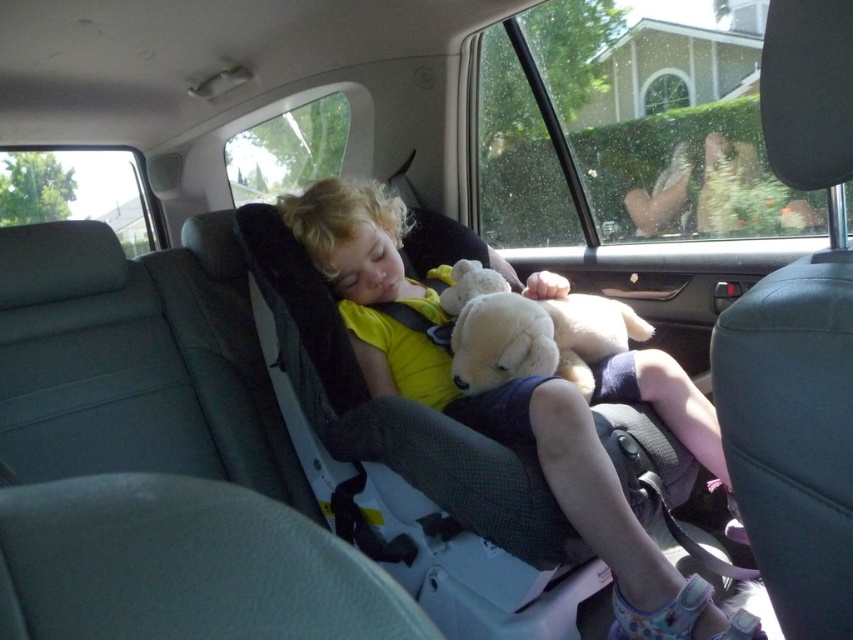
You are a safety inspector checking the car seat installation. You notice the yellow fabric child at center and the white plush teddy bear at center. Which object is positioned closer to the front of the car?

The yellow fabric child at center is closer to the viewer than the white plush teddy bear at center, so the yellow fabric child at center is positioned closer to the front of the car.

You are a safety inspector checking the car seat installation. The car seat must be installed at the center of the backseat. Is the car seat at point (495, 406) properly positioned at the center?

The point (495, 406) is on the yellow fabric child at center, so the car seat is properly positioned at the center of the backseat.

You are a parent checking on your child in the car. You see the yellow fabric child at center and the white plush teddy bear at center. Which object is positioned more to the left?

The yellow fabric child at center is positioned more to the left than the white plush teddy bear at center.